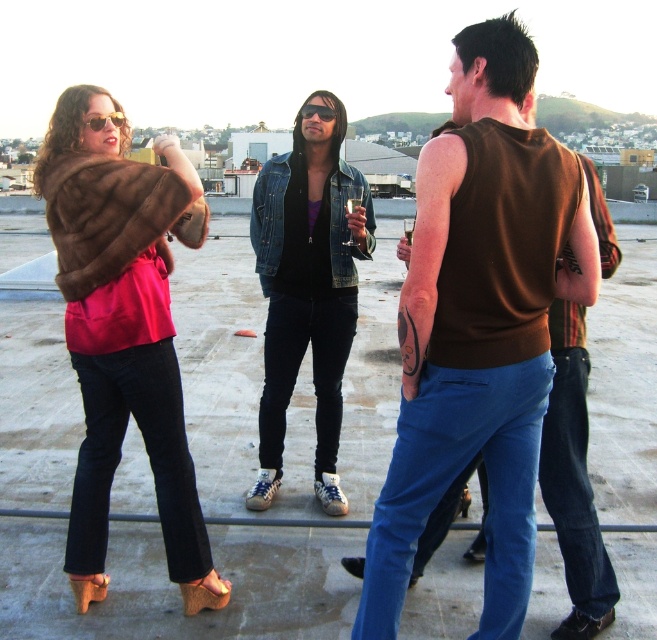
Can you confirm if matte brown fur coat at left is shorter than black matte sunglasses at center?

No.

Is matte brown fur coat at left to the left of black matte sunglasses at center from the viewer's perspective?

Indeed, matte brown fur coat at left is positioned on the left side of black matte sunglasses at center.

Is point (108, 468) positioned before point (327, 109)?

Yes.

The height and width of the screenshot is (640, 657). I want to click on matte brown fur coat at left, so click(124, 332).

From the picture: Which is below, denim jacket at center or brown fur coat at left?

denim jacket at center is lower down.

Which is behind, point (267, 348) or point (133, 198)?

The point (267, 348) is more distant.

You are a GUI agent. You are given a task and a screenshot of the screen. Output one action in this format:
    pyautogui.click(x=<x>, y=<y>)
    Task: Click on the denim jacket at center
    This screenshot has height=640, width=657.
    Given the screenshot: What is the action you would take?
    pyautogui.click(x=307, y=289)

Who is positioned more to the left, matte brown sunglasses at upper left or black matte sunglasses at center?

matte brown sunglasses at upper left is more to the left.

Does point (116, 124) come farther from viewer compared to point (300, 113)?

No, (116, 124) is closer to viewer.

Is point (93, 129) farther from camera compared to point (304, 108)?

That is False.

Locate an element on the screen. matte brown sunglasses at upper left is located at coordinates (102, 120).